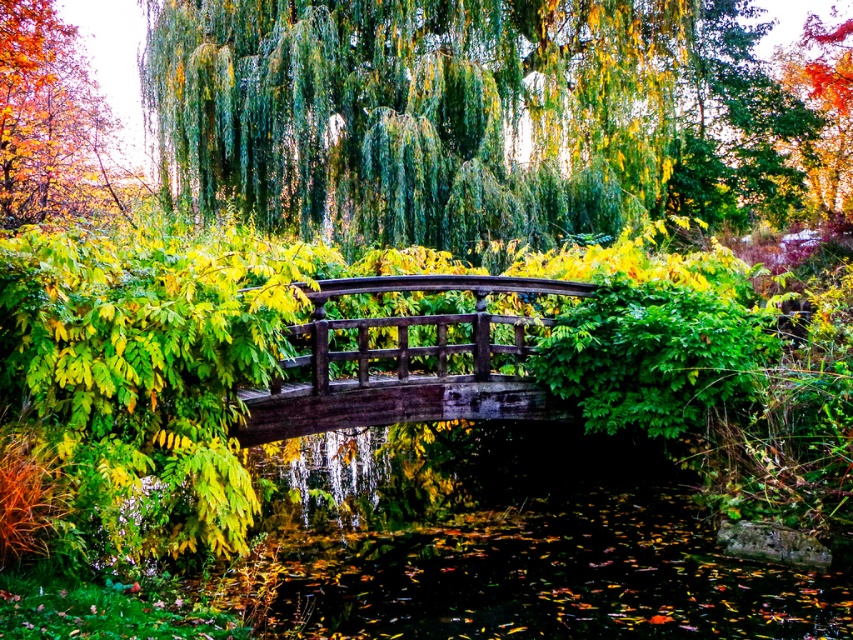
From the picture: You are standing at the point of reference and want to locate the green leafy tree at center. What are its coordinates?

The green leafy tree at center is located at coordinates point [415,113].

You are an artist planning to paint the autumn scene. You want to ensure the green leafy tree at center and wooden bridge at center are proportionally accurate. Which object is wider in the image?

The green leafy tree at center is wider than the wooden bridge at center according to the description.

You are standing on the wooden bridge at center and want to take a photo of the green leafy tree at center. Which direction should you face to capture the tree in your shot?

The green leafy tree at center is positioned on the right side of wooden bridge at center, so you should face to the right to capture the tree in your shot.